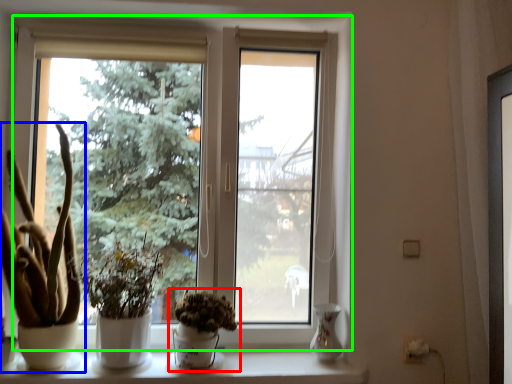
Question: Which object is positioned farthest from houseplant (highlighted by a red box)? Select from houseplant (highlighted by a blue box) and window (highlighted by a green box).

Choices:
 (A) houseplant
 (B) window

Answer: (A)